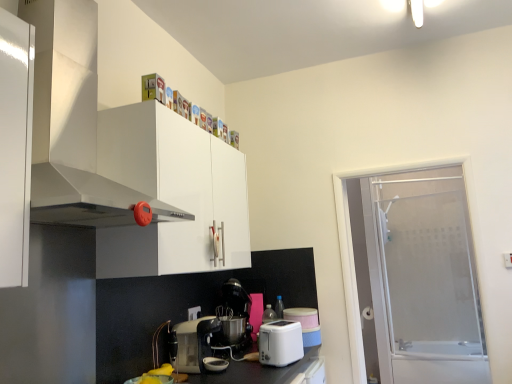
This screenshot has height=384, width=512. What do you see at coordinates (170, 193) in the screenshot?
I see `white glossy cabinet at upper center` at bounding box center [170, 193].

The width and height of the screenshot is (512, 384). What do you see at coordinates (194, 313) in the screenshot?
I see `white plastic electric outlet at lower center` at bounding box center [194, 313].

What do you see at coordinates (234, 316) in the screenshot? I see `metallic silver coffee machine at center` at bounding box center [234, 316].

Find the location of `metallic silver coffee machine at center`. metallic silver coffee machine at center is located at coordinates (234, 316).

The height and width of the screenshot is (384, 512). Describe the element at coordinates (424, 278) in the screenshot. I see `frosted glass screen door at right` at that location.

Describe the element at coordinates (280, 343) in the screenshot. I see `white plastic toaster at lower center, the 1th kitchen appliance in the right-to-left sequence` at that location.

The width and height of the screenshot is (512, 384). I want to click on metallic silver coffee maker at center, the 2th kitchen appliance viewed from the right, so click(x=193, y=343).

Can you tell me how much metallic silver coffee maker at center, which is counted as the 1th kitchen appliance, starting from the left, and frosted glass screen door at right differ in facing direction?

They differ by 89.3 degrees in their facing directions.

Is metallic silver coffee maker at center, the 2th kitchen appliance viewed from the right, not near frosted glass screen door at right?

Yes, metallic silver coffee maker at center, the 2th kitchen appliance viewed from the right, and frosted glass screen door at right are quite far apart.

From a real-world perspective, between metallic silver coffee maker at center, the 2th kitchen appliance viewed from the right, and frosted glass screen door at right, who is vertically lower?

In real-world perspective, metallic silver coffee maker at center, the 2th kitchen appliance viewed from the right, is lower.

Does metallic silver coffee maker at center, which is counted as the 1th kitchen appliance, starting from the left, lie behind frosted glass screen door at right?

No, metallic silver coffee maker at center, which is counted as the 1th kitchen appliance, starting from the left, is closer to the camera.

Is frosted glass screen door at right aimed at white plastic electric outlet at lower center?

No, frosted glass screen door at right is not turned towards white plastic electric outlet at lower center.

From a real-world perspective, who is located higher, frosted glass screen door at right or white plastic electric outlet at lower center?

frosted glass screen door at right, from a real-world perspective.

From the image's perspective, is frosted glass screen door at right on white plastic electric outlet at lower center?

Correct, frosted glass screen door at right appears higher than white plastic electric outlet at lower center in the image.

Which object is further away from the camera taking this photo, frosted glass screen door at right or white plastic electric outlet at lower center?

frosted glass screen door at right is behind.

Which object is thinner, white glossy range hood at upper left or metallic silver coffee machine at center?

With smaller width is metallic silver coffee machine at center.

From the image's perspective, is white glossy range hood at upper left beneath metallic silver coffee machine at center?

Incorrect, from the image's perspective, white glossy range hood at upper left is higher than metallic silver coffee machine at center.

Is the depth of white glossy range hood at upper left less than that of metallic silver coffee machine at center?

Yes, white glossy range hood at upper left is in front of metallic silver coffee machine at center.

Is white glossy range hood at upper left further to the viewer compared to white plastic toaster at lower center, the 2th kitchen appliance positioned from the left?

No, the depth of white glossy range hood at upper left is less than that of white plastic toaster at lower center, the 2th kitchen appliance positioned from the left.

Is white glossy range hood at upper left touching white plastic toaster at lower center, the 2th kitchen appliance positioned from the left?

white glossy range hood at upper left is not next to white plastic toaster at lower center, the 2th kitchen appliance positioned from the left, and they're not touching.

Is white glossy range hood at upper left facing towards white plastic toaster at lower center, the 1th kitchen appliance in the right-to-left sequence?

No, white glossy range hood at upper left does not turn towards white plastic toaster at lower center, the 1th kitchen appliance in the right-to-left sequence.

Which point is more forward, (93, 64) or (266, 345)?

The point (93, 64) is closer to the camera.

Which object is closer to the camera taking this photo, white plastic toaster at lower center, the 2th kitchen appliance positioned from the left, or metallic silver coffee maker at center, which is counted as the 1th kitchen appliance, starting from the left?

metallic silver coffee maker at center, which is counted as the 1th kitchen appliance, starting from the left, is more forward.

Is white plastic toaster at lower center, the 1th kitchen appliance in the right-to-left sequence, smaller than metallic silver coffee maker at center, the 2th kitchen appliance viewed from the right?

Correct, white plastic toaster at lower center, the 1th kitchen appliance in the right-to-left sequence, occupies less space than metallic silver coffee maker at center, the 2th kitchen appliance viewed from the right.

In the scene shown: Considering the relative positions of white plastic toaster at lower center, the 1th kitchen appliance in the right-to-left sequence, and metallic silver coffee maker at center, the 2th kitchen appliance viewed from the right, in the image provided, is white plastic toaster at lower center, the 1th kitchen appliance in the right-to-left sequence, to the left or to the right of metallic silver coffee maker at center, the 2th kitchen appliance viewed from the right,?

Based on their positions, white plastic toaster at lower center, the 1th kitchen appliance in the right-to-left sequence, is located to the right of metallic silver coffee maker at center, the 2th kitchen appliance viewed from the right.

Is white plastic toaster at lower center, the 2th kitchen appliance positioned from the left, aimed at metallic silver coffee maker at center, the 2th kitchen appliance viewed from the right?

No, white plastic toaster at lower center, the 2th kitchen appliance positioned from the left, is not aimed at metallic silver coffee maker at center, the 2th kitchen appliance viewed from the right.

Is point (227, 310) positioned in front of point (203, 213)?

No, it is not.

Considering the relative positions of metallic silver coffee machine at center and white glossy cabinet at upper center in the image provided, is metallic silver coffee machine at center to the left of white glossy cabinet at upper center from the viewer's perspective?

No, metallic silver coffee machine at center is not to the left of white glossy cabinet at upper center.

How distant is metallic silver coffee machine at center from white glossy cabinet at upper center?

They are 33.33 inches apart.

Based on the photo, from a real-world perspective, is metallic silver coffee machine at center positioned above or below white glossy cabinet at upper center?

From a real-world perspective, metallic silver coffee machine at center is physically below white glossy cabinet at upper center.

How different are the orientations of white glossy cabinet at upper center and white glossy range hood at upper left in degrees?

0.000174 degrees.

Locate an element on the screen. The image size is (512, 384). home appliance above the white glossy cabinet at upper center (from the image's perspective) is located at coordinates (73, 123).

Does white glossy cabinet at upper center appear on the left side of white glossy range hood at upper left?

In fact, white glossy cabinet at upper center is to the right of white glossy range hood at upper left.

From the image's perspective, between white glossy cabinet at upper center and white glossy range hood at upper left, who is located below?

From the image's view, white glossy cabinet at upper center is below.

The width and height of the screenshot is (512, 384). Find the location of `screen door lying behind the metallic silver coffee maker at center, the 2th kitchen appliance viewed from the right`. screen door lying behind the metallic silver coffee maker at center, the 2th kitchen appliance viewed from the right is located at coordinates (424, 278).

At what (x,y) coordinates should I click in order to perform the action: click on electric outlet in front of the frosted glass screen door at right. Please return your answer as a coordinate pair (x, y). This screenshot has height=384, width=512. Looking at the image, I should click on (194, 313).

Looking at the image, which one is located further to white plastic electric outlet at lower center, metallic silver coffee maker at center, the 2th kitchen appliance viewed from the right, or white glossy range hood at upper left?

white glossy range hood at upper left is further to white plastic electric outlet at lower center.

From the image, which object appears to be nearer to white glossy range hood at upper left, white plastic electric outlet at lower center or white plastic toaster at lower center, the 2th kitchen appliance positioned from the left?

white plastic toaster at lower center, the 2th kitchen appliance positioned from the left.

When comparing their distances from white plastic toaster at lower center, the 2th kitchen appliance positioned from the left, does frosted glass screen door at right or metallic silver coffee maker at center, the 2th kitchen appliance viewed from the right, seem further?

Among the two, frosted glass screen door at right is located further to white plastic toaster at lower center, the 2th kitchen appliance positioned from the left.

When comparing their distances from metallic silver coffee machine at center, does white glossy range hood at upper left or metallic silver coffee maker at center, which is counted as the 1th kitchen appliance, starting from the left, seem closer?

Among the two, metallic silver coffee maker at center, which is counted as the 1th kitchen appliance, starting from the left, is located nearer to metallic silver coffee machine at center.

When comparing their distances from metallic silver coffee maker at center, which is counted as the 1th kitchen appliance, starting from the left, does frosted glass screen door at right or white glossy range hood at upper left seem closer?

white glossy range hood at upper left is closer to metallic silver coffee maker at center, which is counted as the 1th kitchen appliance, starting from the left.

Looking at the image, which one is located closer to white glossy range hood at upper left, metallic silver coffee maker at center, which is counted as the 1th kitchen appliance, starting from the left, or white glossy cabinet at upper center?

white glossy cabinet at upper center is closer to white glossy range hood at upper left.

Looking at the image, which one is located further to white glossy range hood at upper left, metallic silver coffee maker at center, which is counted as the 1th kitchen appliance, starting from the left, or metallic silver coffee machine at center?

Among the two, metallic silver coffee machine at center is located further to white glossy range hood at upper left.

Based on the photo, which object lies further to the anchor point white glossy cabinet at upper center, white plastic electric outlet at lower center or white plastic toaster at lower center, the 2th kitchen appliance positioned from the left?

white plastic toaster at lower center, the 2th kitchen appliance positioned from the left, is further to white glossy cabinet at upper center.

Find the location of `kitchen appliance situated between metallic silver coffee maker at center, the 2th kitchen appliance viewed from the right, and frosted glass screen door at right from left to right`. kitchen appliance situated between metallic silver coffee maker at center, the 2th kitchen appliance viewed from the right, and frosted glass screen door at right from left to right is located at coordinates (280, 343).

I want to click on cabinetry positioned between white glossy range hood at upper left and metallic silver coffee machine at center from near to far, so click(170, 193).

The height and width of the screenshot is (384, 512). I want to click on kitchen appliance between metallic silver coffee machine at center and frosted glass screen door at right in the horizontal direction, so click(x=280, y=343).

Where is `kitchen appliance located between metallic silver coffee maker at center, the 2th kitchen appliance viewed from the right, and metallic silver coffee machine at center in the depth direction`? This screenshot has height=384, width=512. kitchen appliance located between metallic silver coffee maker at center, the 2th kitchen appliance viewed from the right, and metallic silver coffee machine at center in the depth direction is located at coordinates (280, 343).